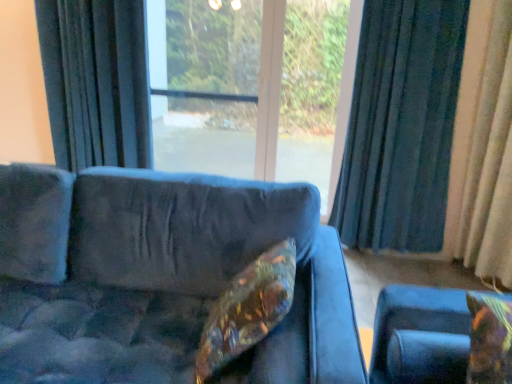
Question: Is velvet blue couch at center bigger than dark blue fabric curtain at right, which is the second curtain in right-to-left order?

Choices:
 (A) no
 (B) yes

Answer: (B)

Question: Is velvet blue couch at center behind dark blue fabric curtain at right, the second curtain viewed from the left?

Choices:
 (A) yes
 (B) no

Answer: (B)

Question: Can you confirm if velvet blue couch at center is thinner than dark blue fabric curtain at right, which is the second curtain in right-to-left order?

Choices:
 (A) no
 (B) yes

Answer: (A)

Question: Could you tell me if velvet blue couch at center is facing dark blue fabric curtain at right, the second curtain viewed from the left?

Choices:
 (A) yes
 (B) no

Answer: (B)

Question: Is dark blue fabric curtain at right, the second curtain viewed from the left, inside velvet blue couch at center?

Choices:
 (A) yes
 (B) no

Answer: (B)

Question: From the image's perspective, is velvet blue couch at center above dark blue fabric curtain at right, the second curtain viewed from the left?

Choices:
 (A) no
 (B) yes

Answer: (A)

Question: Does dark blue fabric curtain at left, the 3th curtain positioned from the right, have a lesser width compared to shiny metallic pillow at center, the first pillow viewed from the left?

Choices:
 (A) no
 (B) yes

Answer: (B)

Question: Is dark blue fabric curtain at left, which is counted as the 1th curtain, starting from the left, positioned before shiny metallic pillow at center, which ranks as the second pillow in right-to-left order?

Choices:
 (A) yes
 (B) no

Answer: (B)

Question: From the image's perspective, would you say dark blue fabric curtain at left, the 3th curtain positioned from the right, is positioned over shiny metallic pillow at center, the first pillow viewed from the left?

Choices:
 (A) yes
 (B) no

Answer: (A)

Question: Is dark blue fabric curtain at left, which is counted as the 1th curtain, starting from the left, oriented towards shiny metallic pillow at center, which ranks as the second pillow in right-to-left order?

Choices:
 (A) no
 (B) yes

Answer: (A)

Question: Is dark blue fabric curtain at left, the 3th curtain positioned from the right, oriented away from shiny metallic pillow at center, the first pillow viewed from the left?

Choices:
 (A) yes
 (B) no

Answer: (B)

Question: Considering the relative sizes of dark blue fabric curtain at left, which is counted as the 1th curtain, starting from the left, and shiny metallic pillow at center, which ranks as the second pillow in right-to-left order, in the image provided, is dark blue fabric curtain at left, which is counted as the 1th curtain, starting from the left, shorter than shiny metallic pillow at center, which ranks as the second pillow in right-to-left order,?

Choices:
 (A) yes
 (B) no

Answer: (B)

Question: Is the surface of shiny metallic pillow at center, which ranks as the second pillow in right-to-left order, in direct contact with beige fabric curtain at right, the 3th curtain when ordered from left to right?

Choices:
 (A) yes
 (B) no

Answer: (B)